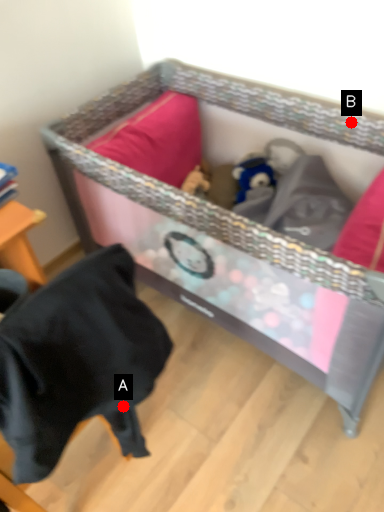
Question: Two points are circled on the image, labeled by A and B beside each circle. Which point appears farthest from the camera in this image?

Choices:
 (A) A is further
 (B) B is further

Answer: (B)